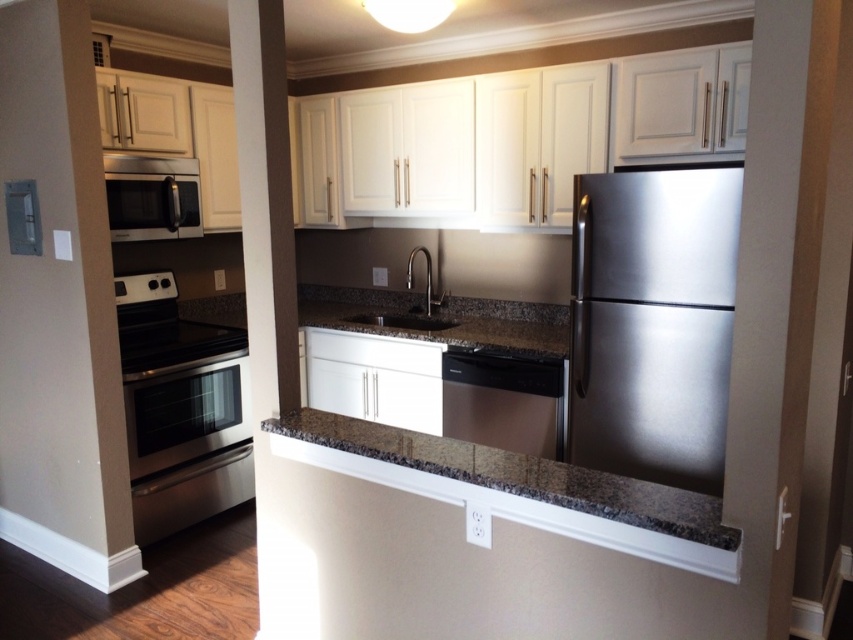
Question: Can you confirm if stainless steel refrigerator at right is positioned above granite sink at center?

Choices:
 (A) no
 (B) yes

Answer: (A)

Question: Which object is positioned closest to the stainless steel microwave at left?

Choices:
 (A) stainless steel refrigerator at right
 (B) stainless steel oven at left
 (C) satin stainless steel dishwasher at center

Answer: (B)

Question: Does stainless steel refrigerator at right have a larger size compared to satin stainless steel dishwasher at center?

Choices:
 (A) yes
 (B) no

Answer: (A)

Question: In this image, where is stainless steel oven at left located relative to granite countertop at center?

Choices:
 (A) left
 (B) right

Answer: (A)

Question: Which point is closer to the camera taking this photo?

Choices:
 (A) (578, 236)
 (B) (426, 314)
 (C) (178, 442)

Answer: (A)

Question: Among these objects, which one is farthest from the camera?

Choices:
 (A) granite sink at center
 (B) granite countertop at center

Answer: (A)